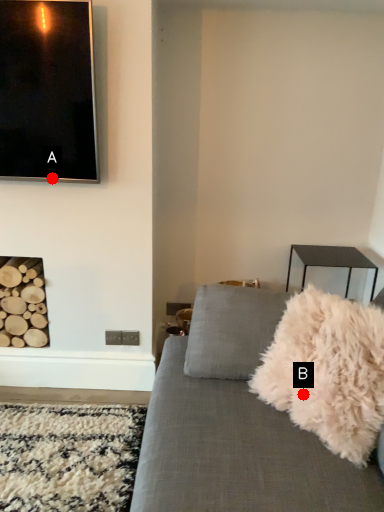
Question: Two points are circled on the image, labeled by A and B beside each circle. Among these points, which one is nearest to the camera?

Choices:
 (A) A is closer
 (B) B is closer

Answer: (B)